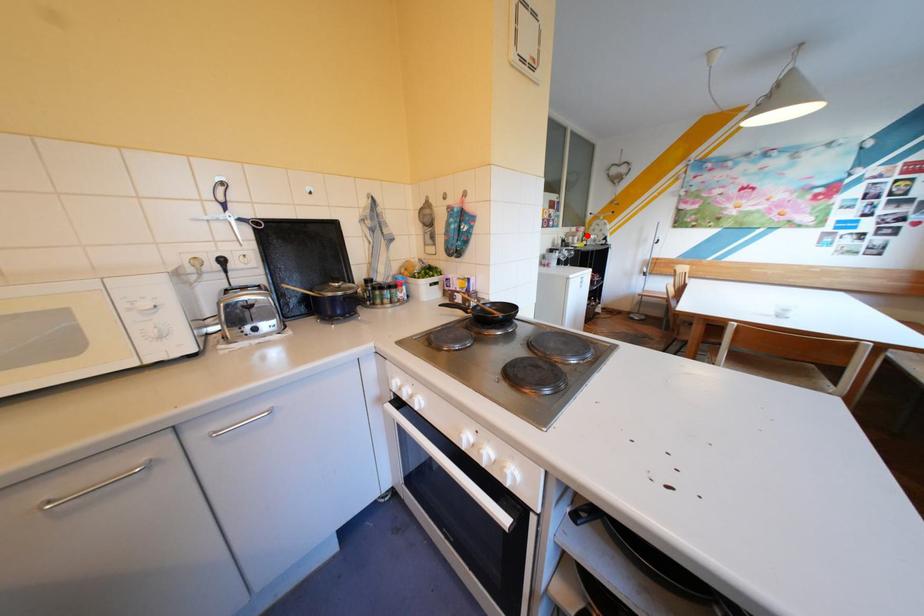
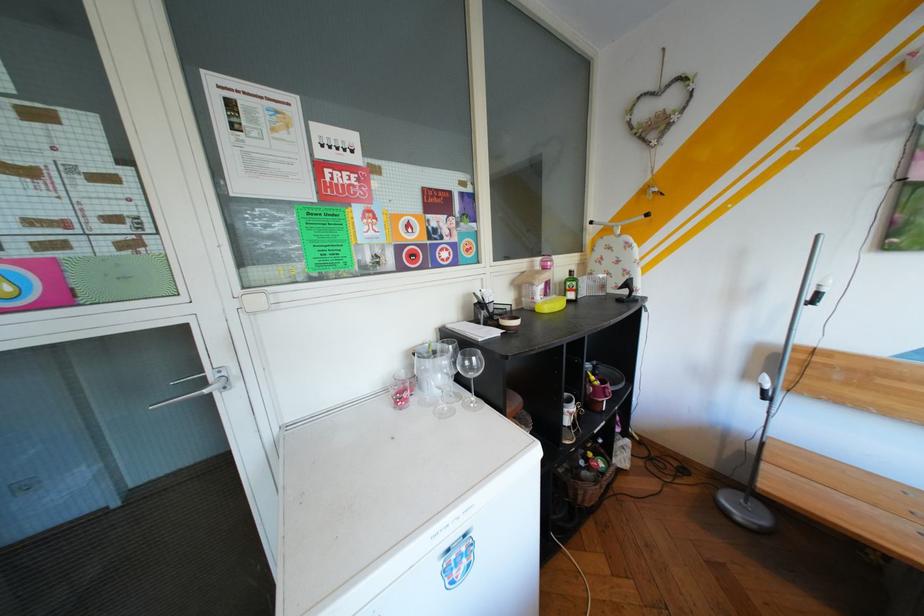
Find the pixel in the second image that matches the highlighted location in the first image.

(545, 284)